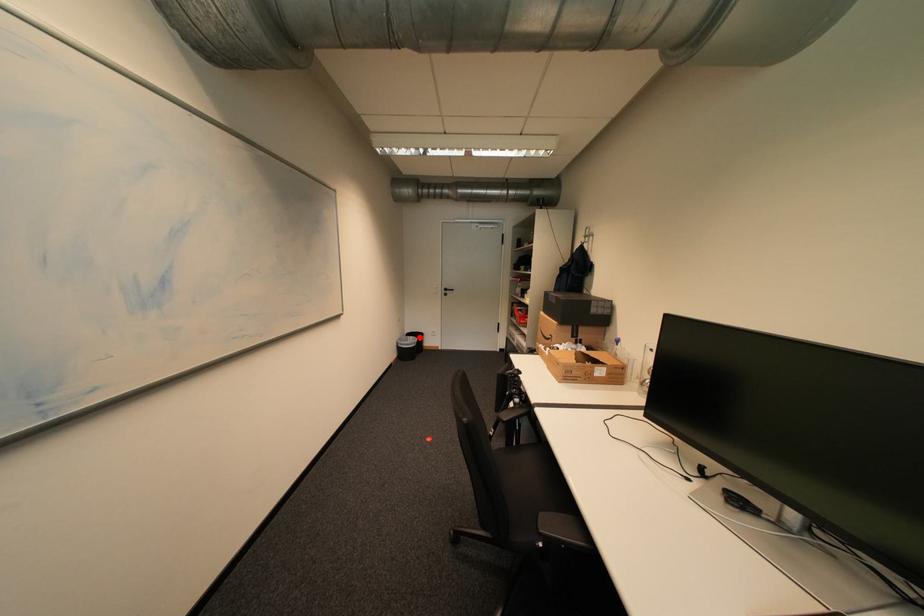
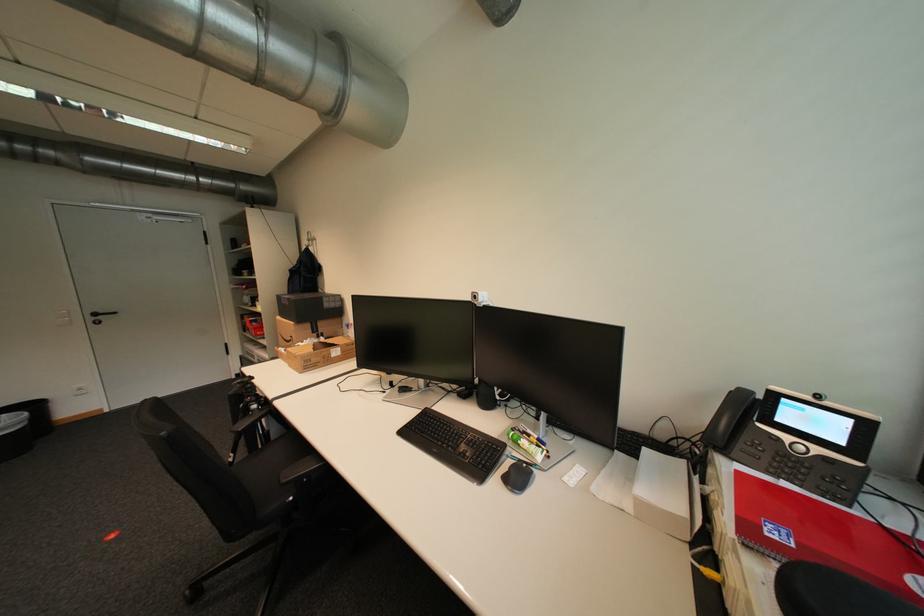
Question: A red point is marked in image1. In image2, is the corresponding 3D point closer to the camera or farther? Reply with the corresponding letter.

Choices:
 (A) The corresponding 3D point is closer.
 (B) The corresponding 3D point is farther.

Answer: (B)